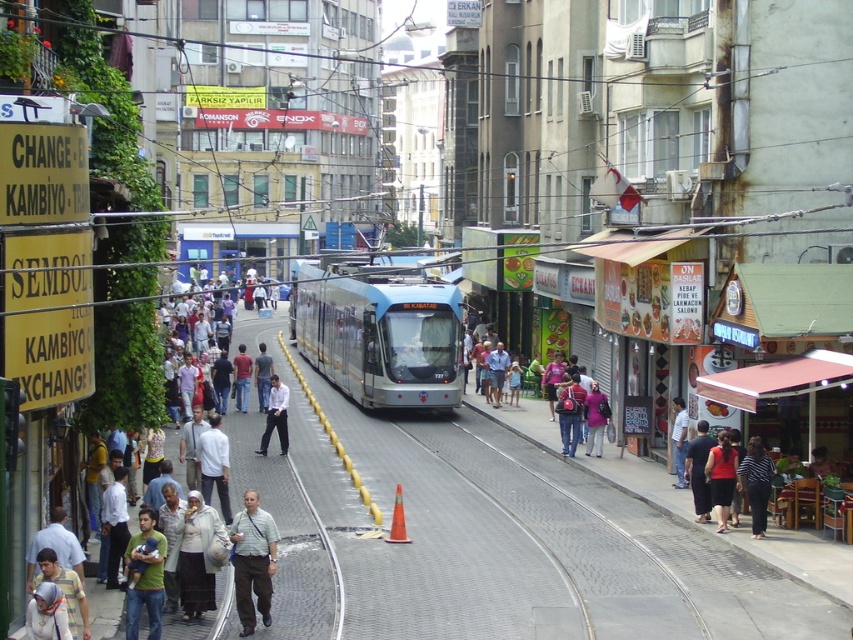
You are a tourist in Istanbul and see the light gray shirt at center and the light brown leather jacket at center. Which clothing item is positioned lower on the person?

The light gray shirt at center is below the light brown leather jacket at center, so the light gray shirt at center is positioned lower on the person.

Based on the photo, you are a delivery person needing to deliver a package to the address located at the white shirt at center. Your delivery robot has a maximum range of 15 meters. Can it reach the destination from your current position near the light brown leather jacket at center?

The light brown leather jacket at center is 16.34 meters from the white shirt at center. Since the robot has a maximum range of 15 meters, it cannot reach the destination.

You are a traveler in Turkey and see both the light brown leather jacket at center and the green cotton shirt at center in a store. Which one takes up more space on the rack?

The light brown leather jacket at center is bigger than the green cotton shirt at center, so it takes up more space on the rack.